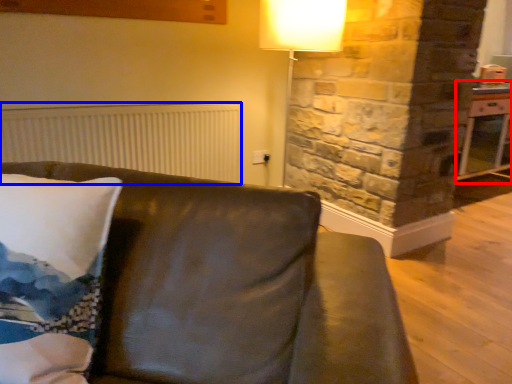
Question: Which object appears farthest to the camera in this image, table (highlighted by a red box) or radiator (highlighted by a blue box)?

Choices:
 (A) table
 (B) radiator

Answer: (A)